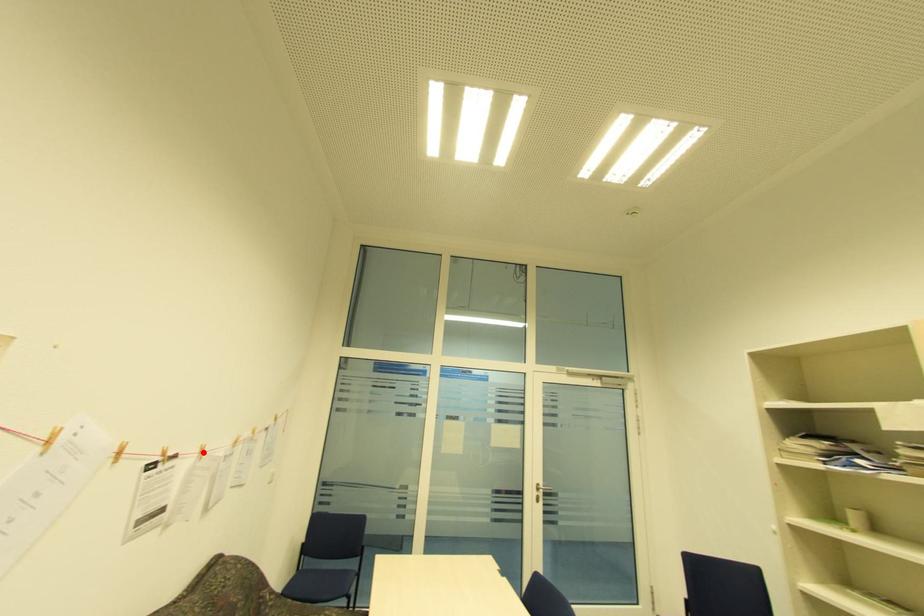
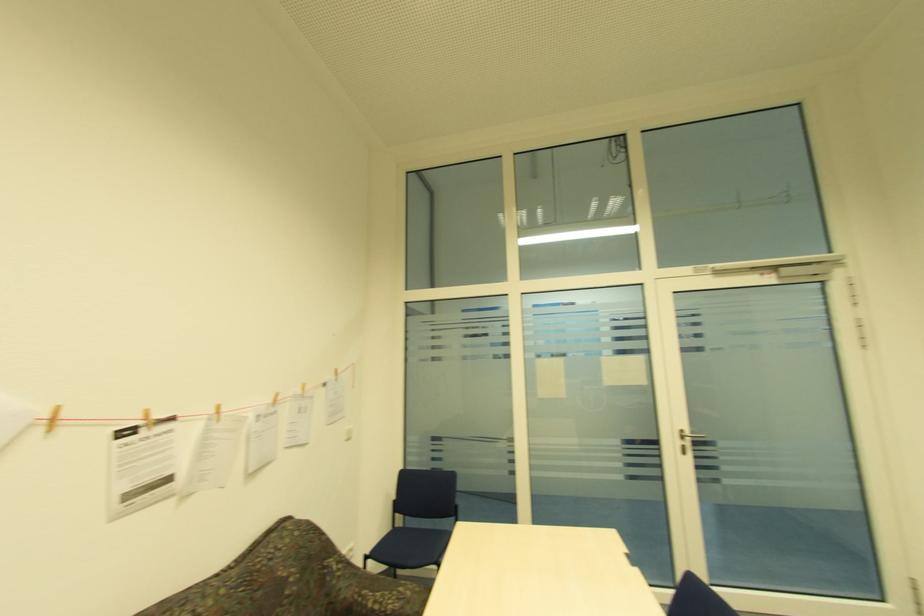
Locate, in the second image, the point that corresponds to the highlighted location in the first image.

(219, 413)